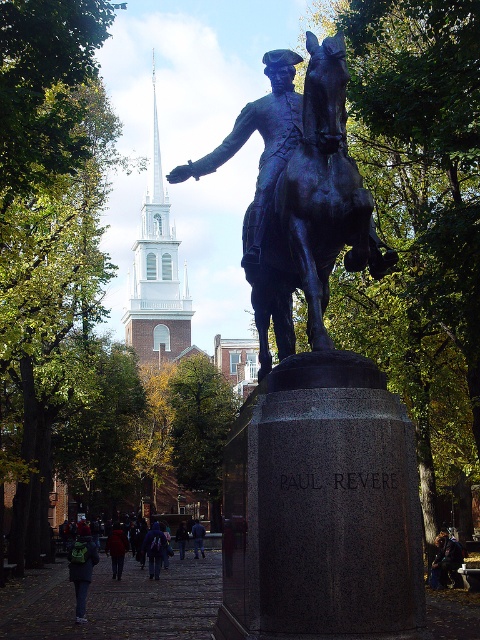
Question: Does white steeple at upper left lie in front of dark blue coat at center?

Choices:
 (A) no
 (B) yes

Answer: (A)

Question: Among these points, which one is nearest to the camera?

Choices:
 (A) (312, 500)
 (B) (91, 600)
 (C) (117, 540)

Answer: (A)

Question: Is bronze statue at center to the right of dark blue jeans at lower center from the viewer's perspective?

Choices:
 (A) yes
 (B) no

Answer: (A)

Question: Is bronze statue at center wider than green fabric backpack at lower left?

Choices:
 (A) no
 (B) yes

Answer: (A)

Question: Estimate the real-world distances between objects in this image. Which object is closer to the blue jeans at lower center?

Choices:
 (A) dark blue coat at center
 (B) dark blue jeans at center
 (C) green fabric backpack at lower left

Answer: (C)

Question: Which of the following is the farthest from the observer?

Choices:
 (A) (151, 552)
 (B) (115, 563)

Answer: (A)